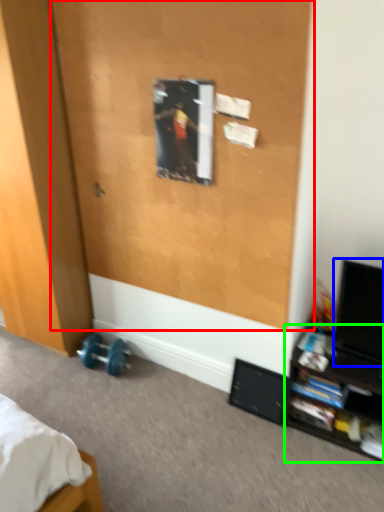
Question: Estimate the real-world distances between objects in this image. Which object is closer to screen door (highlighted by a red box), computer monitor (highlighted by a blue box) or shelf (highlighted by a green box)?

Choices:
 (A) computer monitor
 (B) shelf

Answer: (A)